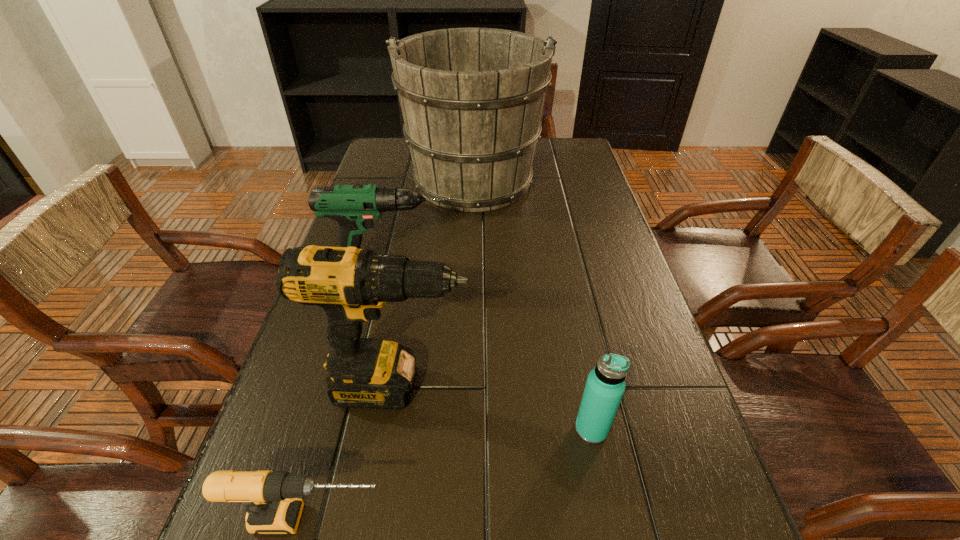
I want to click on vacant point at the left edge, so click(x=323, y=417).

What are the coordinates of `vacant space at the right edge` in the screenshot? It's located at (708, 480).

Find the location of a particular element. Image resolution: width=960 pixels, height=540 pixels. free location at the far right corner of the desktop is located at coordinates (581, 141).

This screenshot has width=960, height=540. I want to click on free spot between the second nearest drill and the third tallest object, so click(396, 332).

You are a GUI agent. You are given a task and a screenshot of the screen. Output one action in this format:
    pyautogui.click(x=<x>, y=<y>)
    Task: Click on the free space between the second shortest object and the second tallest drill
    This screenshot has height=540, width=960.
    Given the screenshot: What is the action you would take?
    pyautogui.click(x=492, y=353)

The image size is (960, 540). Identify the location of free space between the shortest object and the second farthest drill. (354, 453).

I want to click on vacant space that is in between the fourth tallest object and the nearest object, so click(451, 474).

In order to click on empty space that is in between the third shortest object and the tallest drill in this screenshot , I will do `click(396, 332)`.

This screenshot has width=960, height=540. Find the location of `empty space between the fourth nearest object and the water bottle`. empty space between the fourth nearest object and the water bottle is located at coordinates (492, 353).

Where is `vacant region between the water bottle and the tallest drill`? Image resolution: width=960 pixels, height=540 pixels. vacant region between the water bottle and the tallest drill is located at coordinates (494, 408).